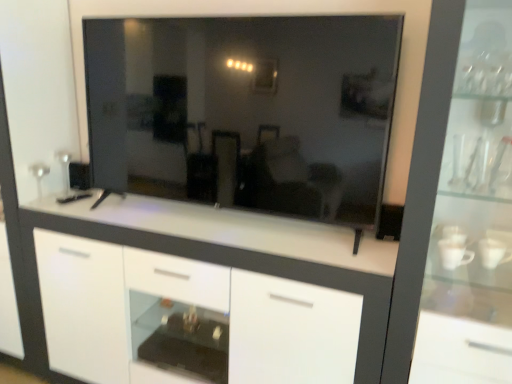
Question: Is transparent glass cabinet at right smaller than transparent glass mirror at center?

Choices:
 (A) no
 (B) yes

Answer: (A)

Question: Is transparent glass cabinet at right closer to camera compared to transparent glass mirror at center?

Choices:
 (A) no
 (B) yes

Answer: (B)

Question: Is the position of transparent glass cabinet at right more distant than that of transparent glass mirror at center?

Choices:
 (A) yes
 (B) no

Answer: (B)

Question: Is transparent glass cabinet at right completely or partially outside of transparent glass mirror at center?

Choices:
 (A) yes
 (B) no

Answer: (A)

Question: Can you confirm if transparent glass cabinet at right is wider than transparent glass mirror at center?

Choices:
 (A) yes
 (B) no

Answer: (A)

Question: From the image's perspective, relative to white glossy cabinet at center, is transparent glass mirror at center above or below?

Choices:
 (A) below
 (B) above

Answer: (B)

Question: Does point (211, 140) appear closer or farther from the camera than point (317, 297)?

Choices:
 (A) closer
 (B) farther

Answer: (B)

Question: Visually, is transparent glass mirror at center positioned to the left or to the right of white glossy cabinet at center?

Choices:
 (A) right
 (B) left

Answer: (A)

Question: From a real-world perspective, is transparent glass mirror at center above or below white glossy cabinet at center?

Choices:
 (A) above
 (B) below

Answer: (A)

Question: Relative to white glossy cabinet at center, is transparent glass cabinet at right in front or behind?

Choices:
 (A) front
 (B) behind

Answer: (A)

Question: From the image's perspective, is transparent glass cabinet at right located above or below white glossy cabinet at center?

Choices:
 (A) above
 (B) below

Answer: (A)

Question: Is transparent glass cabinet at right taller or shorter than white glossy cabinet at center?

Choices:
 (A) tall
 (B) short

Answer: (A)

Question: From a real-world perspective, is transparent glass cabinet at right physically located above or below white glossy cabinet at center?

Choices:
 (A) below
 (B) above

Answer: (B)

Question: Is white glossy cabinet at center wider or thinner than transparent glass mirror at center?

Choices:
 (A) wide
 (B) thin

Answer: (A)

Question: Does point (201, 306) appear closer or farther from the camera than point (147, 193)?

Choices:
 (A) farther
 (B) closer

Answer: (B)